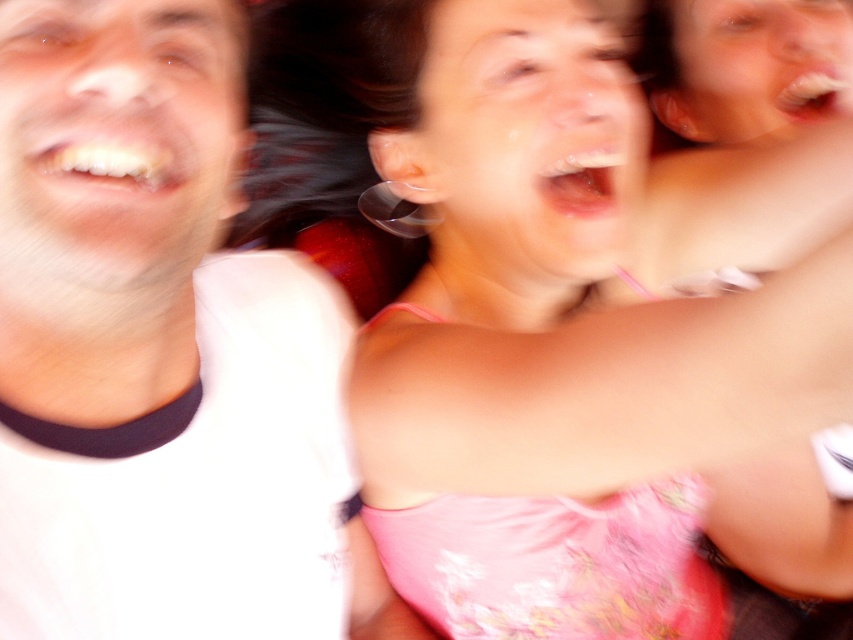
Question: Which point is farther to the camera?

Choices:
 (A) (241, 474)
 (B) (550, 301)

Answer: (B)

Question: Is white matte t-shirt at left thinner than pink satin dress at upper center?

Choices:
 (A) yes
 (B) no

Answer: (A)

Question: Is white matte t-shirt at left above pink satin dress at upper center?

Choices:
 (A) yes
 (B) no

Answer: (B)

Question: Does white matte t-shirt at left appear over pink satin dress at upper center?

Choices:
 (A) yes
 (B) no

Answer: (B)

Question: Which of the following is the closest to the observer?

Choices:
 (A) pink satin dress at upper center
 (B) white matte t-shirt at left

Answer: (A)

Question: Which of the following is the farthest from the observer?

Choices:
 (A) pink satin dress at upper center
 (B) white matte t-shirt at left

Answer: (B)